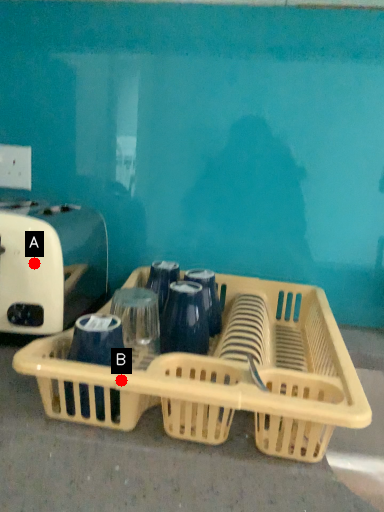
Question: Two points are circled on the image, labeled by A and B beside each circle. Which point is farther to the camera?

Choices:
 (A) A is further
 (B) B is further

Answer: (A)